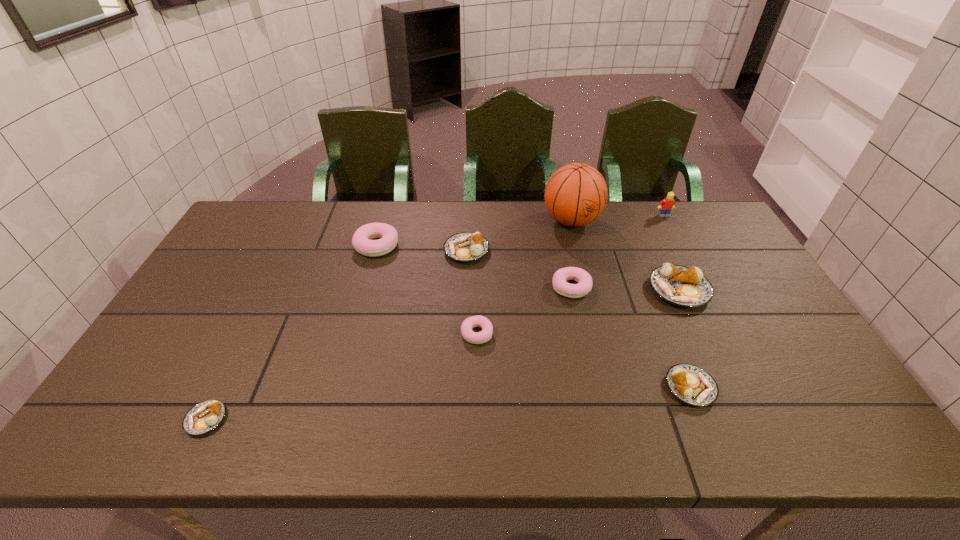
Find the location of `orange basketball`. orange basketball is located at coordinates (576, 194).

The width and height of the screenshot is (960, 540). Find the location of `basketball`. basketball is located at coordinates (576, 194).

This screenshot has width=960, height=540. I want to click on yellow Lego, so click(667, 204).

Image resolution: width=960 pixels, height=540 pixels. In order to click on the eighth shortest object in this screenshot , I will do `click(667, 204)`.

You are a GUI agent. You are given a task and a screenshot of the screen. Output one action in this format:
    pyautogui.click(x=<x>, y=<y>)
    Task: Click on the second farthest brown pastry
    Image resolution: width=960 pixels, height=540 pixels.
    Given the screenshot: What is the action you would take?
    pyautogui.click(x=687, y=287)

Where is `the farthest pink pastry`? The height and width of the screenshot is (540, 960). the farthest pink pastry is located at coordinates click(x=361, y=241).

This screenshot has width=960, height=540. I want to click on the second object from left to right, so click(x=361, y=241).

Where is `the farthest brown pastry`? The height and width of the screenshot is (540, 960). the farthest brown pastry is located at coordinates pos(466,246).

Find the location of a particular element. the second brown pastry from left to right is located at coordinates (466, 246).

You are a GUI agent. You are given a task and a screenshot of the screen. Output one action in this format:
    pyautogui.click(x=<x>, y=<y>)
    Task: Click on the rightmost pink pastry
    This screenshot has width=960, height=540.
    Given the screenshot: What is the action you would take?
    pyautogui.click(x=584, y=286)